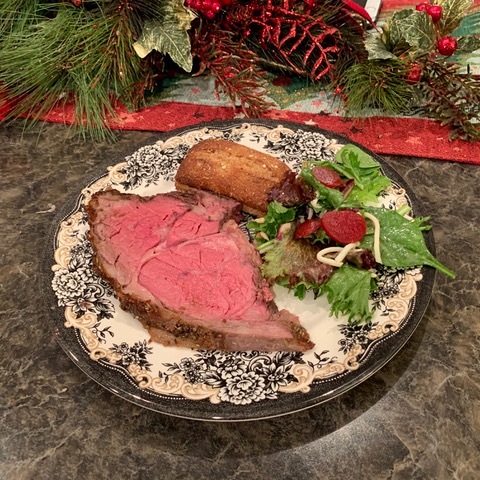
This screenshot has width=480, height=480. Identify the location of doily. (323, 331).